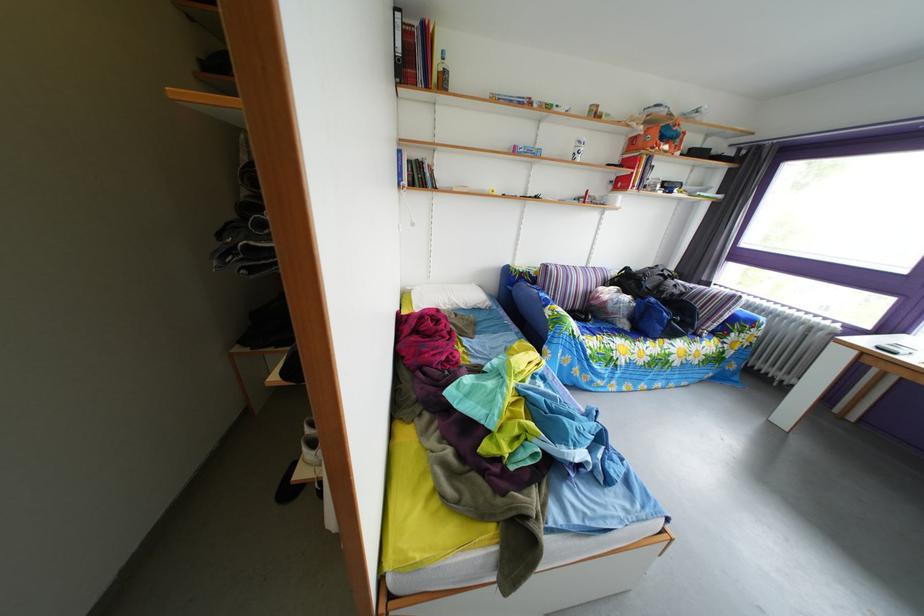
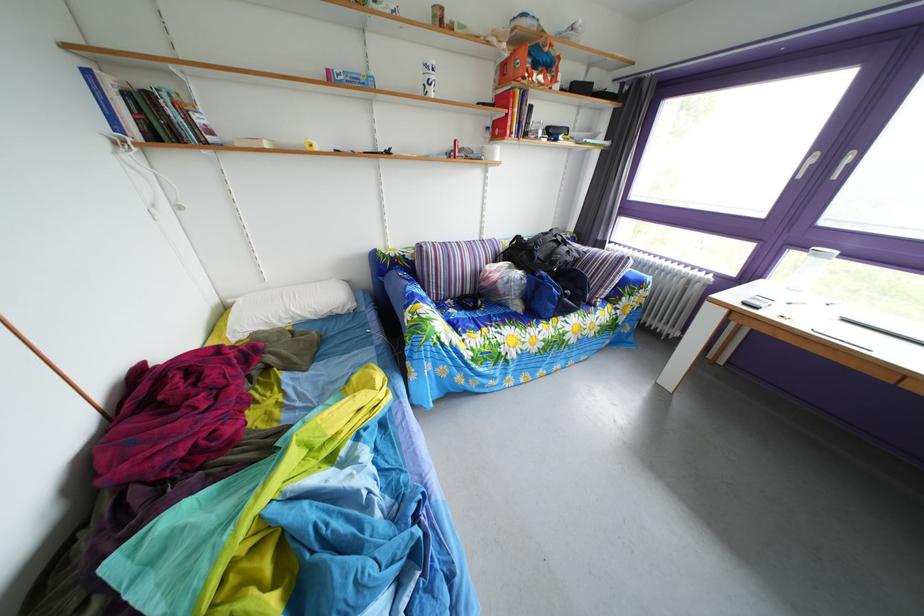
Find the pixel in the second image that matches the point at 638,289 in the first image.

(529, 261)